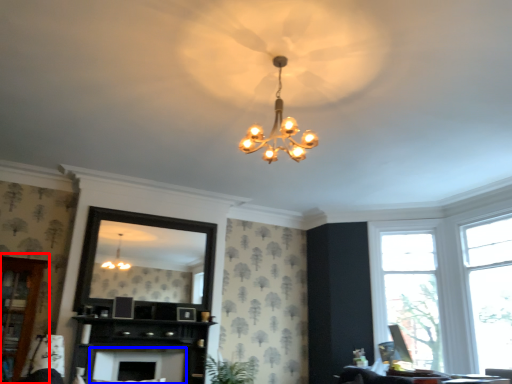
Question: Which object is further to the camera taking this photo, dresser (highlighted by a red box) or fireplace (highlighted by a blue box)?

Choices:
 (A) dresser
 (B) fireplace

Answer: (B)